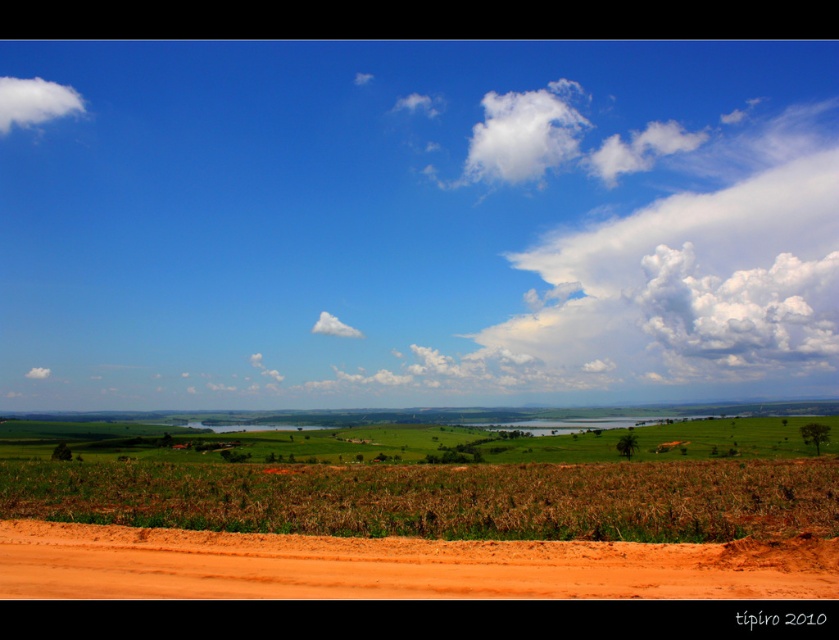
Based on the photo, which is more to the right, dusty orange dirt at bottom or white fluffy cloud at upper left?

Positioned to the right is dusty orange dirt at bottom.

Does point (650, 582) lie in front of point (45, 92)?

Yes.

Identify the location of dusty orange dirt at bottom. Image resolution: width=839 pixels, height=640 pixels. (395, 566).

Looking at this image, can you confirm if white fluffy cloud at upper left is positioned to the left of white fluffy cloud at center?

Indeed, white fluffy cloud at upper left is positioned on the left side of white fluffy cloud at center.

Based on the photo, does white fluffy cloud at upper left have a greater height compared to white fluffy cloud at center?

Indeed, white fluffy cloud at upper left has a greater height compared to white fluffy cloud at center.

Image resolution: width=839 pixels, height=640 pixels. What are the coordinates of `white fluffy cloud at upper left` in the screenshot? It's located at (35, 100).

Image resolution: width=839 pixels, height=640 pixels. What are the coordinates of `white fluffy cloud at upper left` in the screenshot? It's located at (35, 100).

Between point (155, 573) and point (39, 376), which one is positioned in front?

Positioned in front is point (155, 573).

Between dusty orange dirt at bottom and white fluffy cloud at upper center, which one appears on the left side from the viewer's perspective?

white fluffy cloud at upper center is more to the left.

Is point (438, 540) positioned behind point (40, 369)?

No, it is in front of (40, 369).

Identify the location of dusty orange dirt at bottom. This screenshot has height=640, width=839. (395, 566).